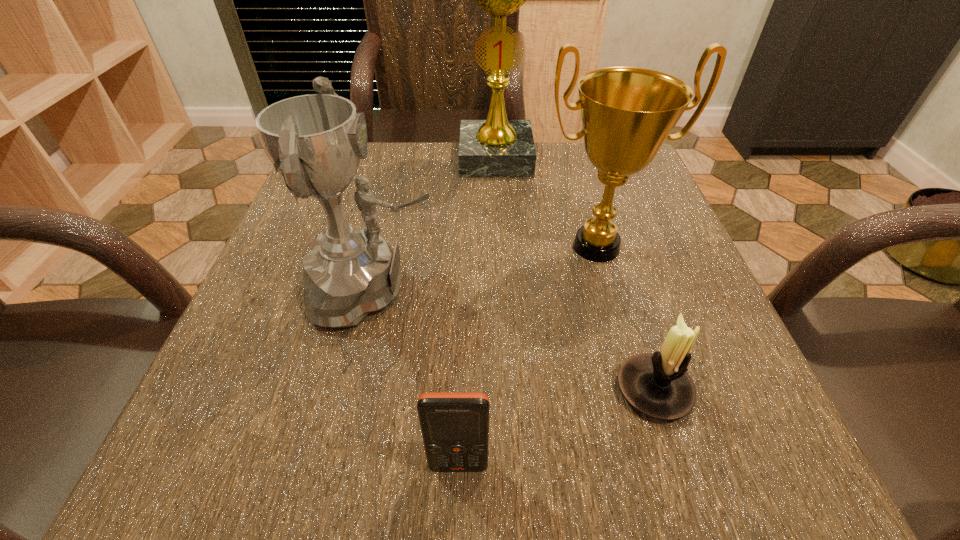
You are a GUI agent. You are given a task and a screenshot of the screen. Output one action in this format:
    pyautogui.click(x=<x>, y=<y>)
    Task: Click on the award that is the nearest to the second nearest object
    The width and height of the screenshot is (960, 540).
    Given the screenshot: What is the action you would take?
    pyautogui.click(x=627, y=113)

The image size is (960, 540). In order to click on vacant space that satisfies the following two spatial constraints: 1. on the side with emblem of the leftmost award; 2. on the back side of the candle holder in this screenshot , I will do `click(351, 390)`.

Where is `free location that satisfies the following two spatial constraints: 1. on the front-facing side of the farthest award; 2. on the side with emblem of the leftmost object`? free location that satisfies the following two spatial constraints: 1. on the front-facing side of the farthest award; 2. on the side with emblem of the leftmost object is located at coordinates (502, 289).

Find the location of a particular element. free space that satisfies the following two spatial constraints: 1. on the side with emblem of the leftmost award; 2. on the right side of the fourth farthest object is located at coordinates (351, 390).

Identify the location of free spot that satisfies the following two spatial constraints: 1. on the front-facing side of the farthest object; 2. on the side with emblem of the leftmost award. This screenshot has width=960, height=540. (502, 289).

You are a GUI agent. You are given a task and a screenshot of the screen. Output one action in this format:
    pyautogui.click(x=<x>, y=<y>)
    Task: Click on the free space that satisfies the following two spatial constraints: 1. on the back side of the candle holder; 2. on the side with emblem of the leftmost award
    The height and width of the screenshot is (540, 960).
    Given the screenshot: What is the action you would take?
    pyautogui.click(x=622, y=289)